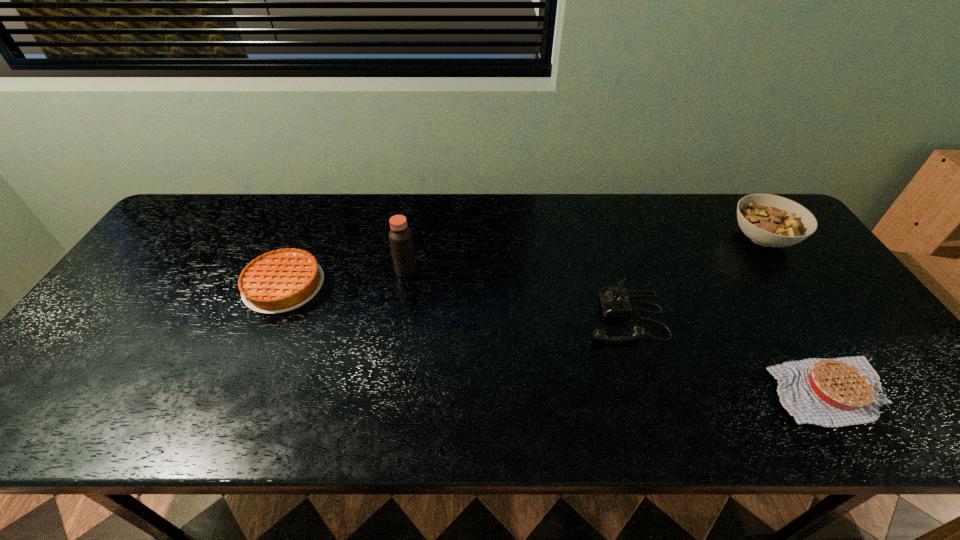
Locate an element on the screen. This screenshot has width=960, height=540. the tallest object is located at coordinates (400, 236).

Where is `vinegar`? The height and width of the screenshot is (540, 960). vinegar is located at coordinates (400, 236).

At what (x,y) coordinates should I click in order to perform the action: click on stew. Please return your answer as a coordinate pair (x, y). This screenshot has height=540, width=960. Looking at the image, I should click on (769, 220).

Where is `telephone`? The width and height of the screenshot is (960, 540). telephone is located at coordinates (615, 303).

Locate an element on the screen. the third tallest object is located at coordinates (615, 303).

The height and width of the screenshot is (540, 960). I want to click on the second shortest object, so click(x=278, y=281).

Where is `the taller pie`? The height and width of the screenshot is (540, 960). the taller pie is located at coordinates (278, 281).

I want to click on the right pie, so click(838, 392).

What are the coordinates of `the shortest object` in the screenshot? It's located at (838, 392).

Where is `vacant space located 0.210m on the back of the vinegar`? The height and width of the screenshot is (540, 960). vacant space located 0.210m on the back of the vinegar is located at coordinates (415, 218).